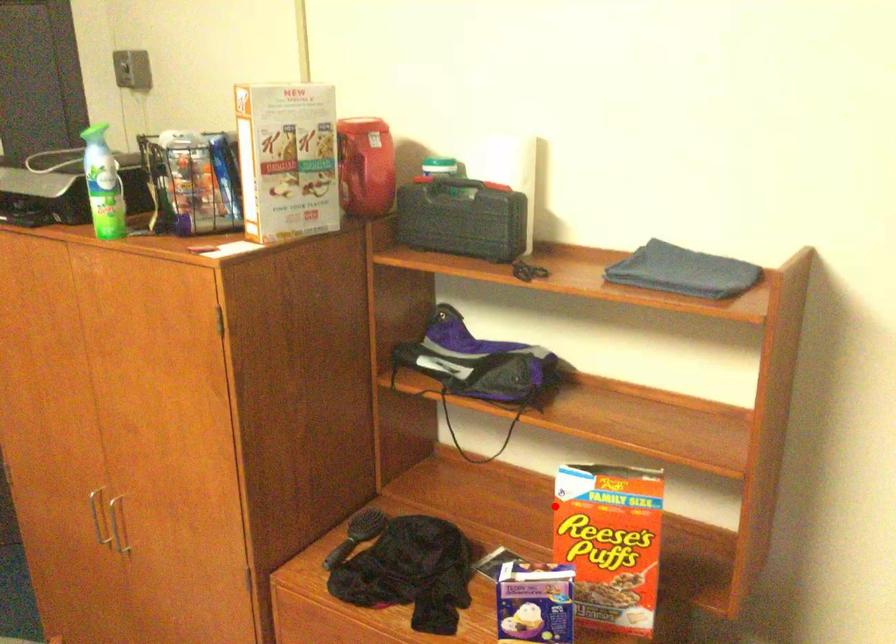
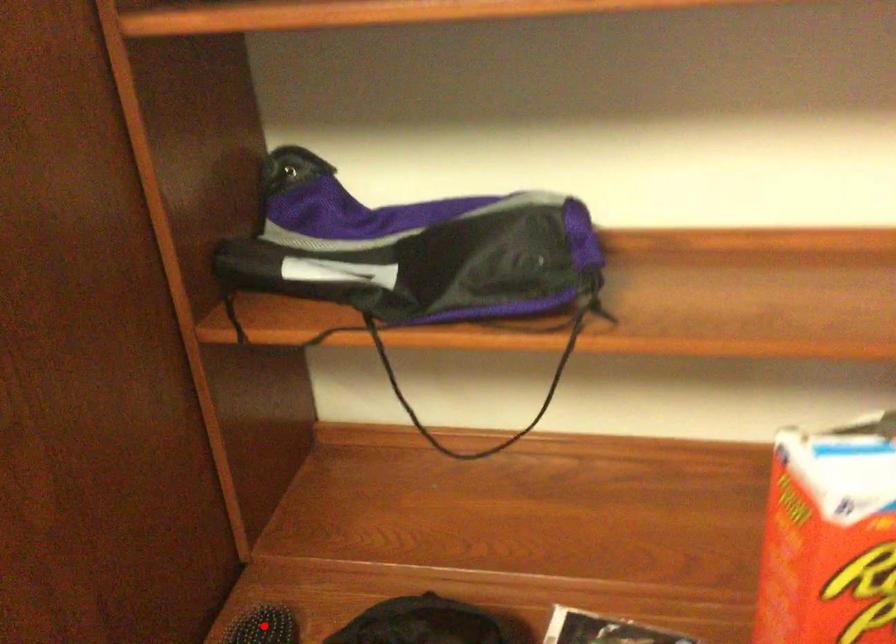
I am providing you with two images of the same scene from different viewpoints. A red point is marked on the first image and another point is marked on the second image. Do the highlighted points in image1 and image2 indicate the same real-world spot?

No